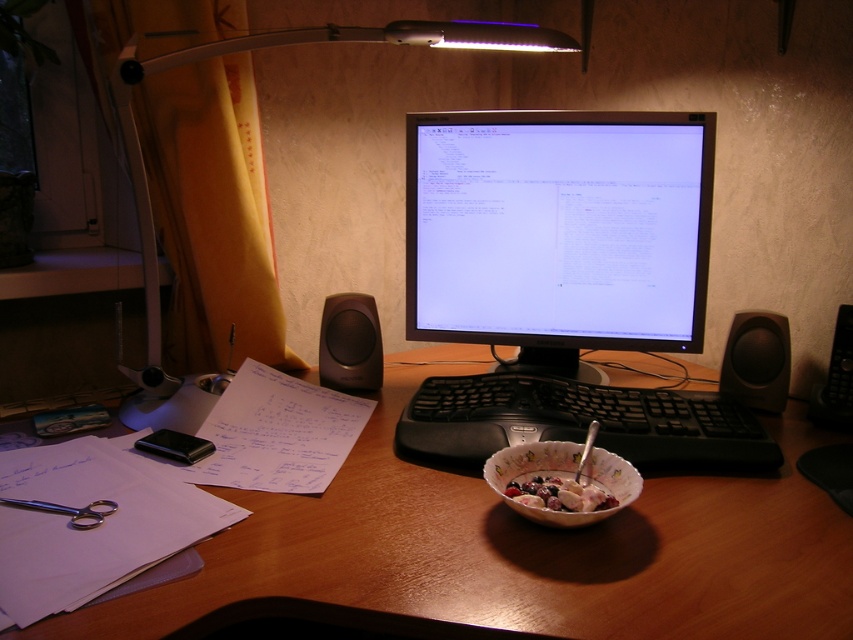
Question: Can you confirm if white plastic lamp at upper center is wider than black plastic speaker at right?

Choices:
 (A) yes
 (B) no

Answer: (A)

Question: Which point appears closest to the camera in this image?

Choices:
 (A) pos(576,387)
 (B) pos(177,413)
 (C) pos(538,346)

Answer: (B)

Question: Can you confirm if matte black monitor at center is positioned above matte black speaker at lower left?

Choices:
 (A) yes
 (B) no

Answer: (A)

Question: Where is wooden at center located in relation to black plastic keyboard at center in the image?

Choices:
 (A) right
 (B) left

Answer: (B)

Question: Which point is closer to the camera taking this photo?

Choices:
 (A) (585, 500)
 (B) (389, 538)

Answer: (B)

Question: Which object is the closest to the porcelain bowl at center?

Choices:
 (A) white plastic lamp at upper center
 (B) matte black speaker at lower left
 (C) matte black monitor at center

Answer: (B)